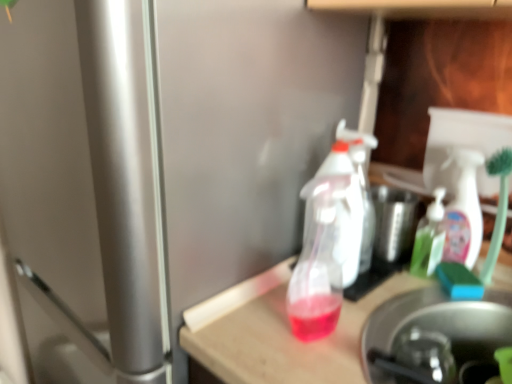
Locate an element on the screen. This screenshot has width=512, height=384. vacant area that lies in front of green translucent soap dispenser at center, which is counted as the 2th bottle, starting from the left is located at coordinates (419, 301).